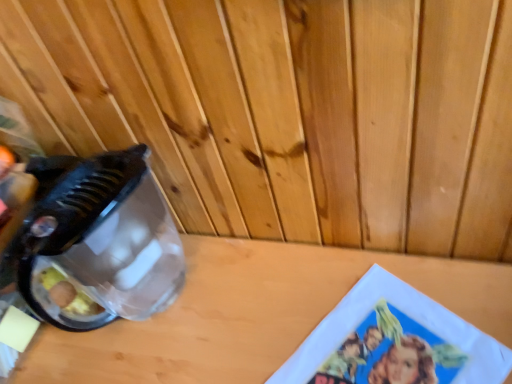
Where is `free region under transparent plastic blender at left (from a real-world perspective)`? The width and height of the screenshot is (512, 384). free region under transparent plastic blender at left (from a real-world perspective) is located at coordinates (158, 301).